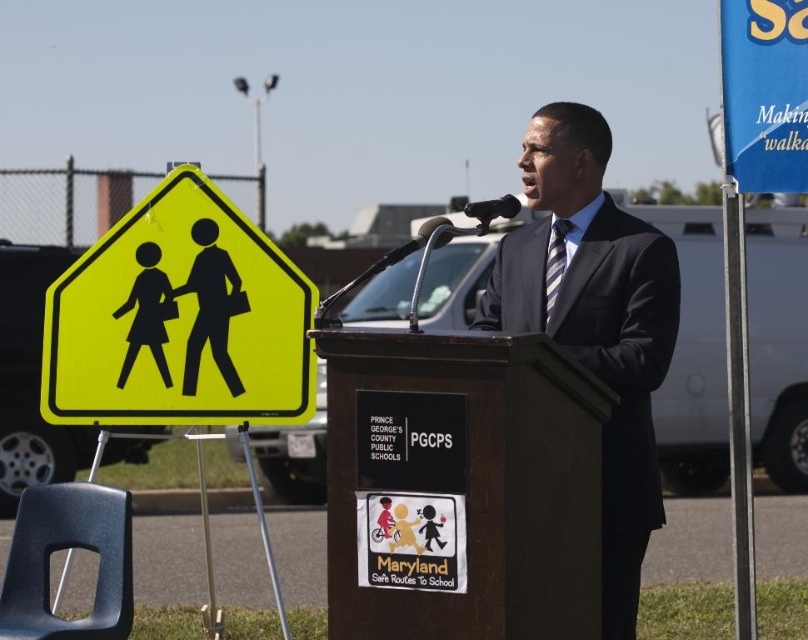
Question: Considering the relative positions of yellow plastic sign at left and dark blue suit at center in the image provided, where is yellow plastic sign at left located with respect to dark blue suit at center?

Choices:
 (A) below
 (B) above

Answer: (B)

Question: Is yellow plastic sign at left wider than dark blue suit at center?

Choices:
 (A) yes
 (B) no

Answer: (A)

Question: Is yellow plastic sign at left closer to camera compared to dark blue suit at center?

Choices:
 (A) yes
 (B) no

Answer: (B)